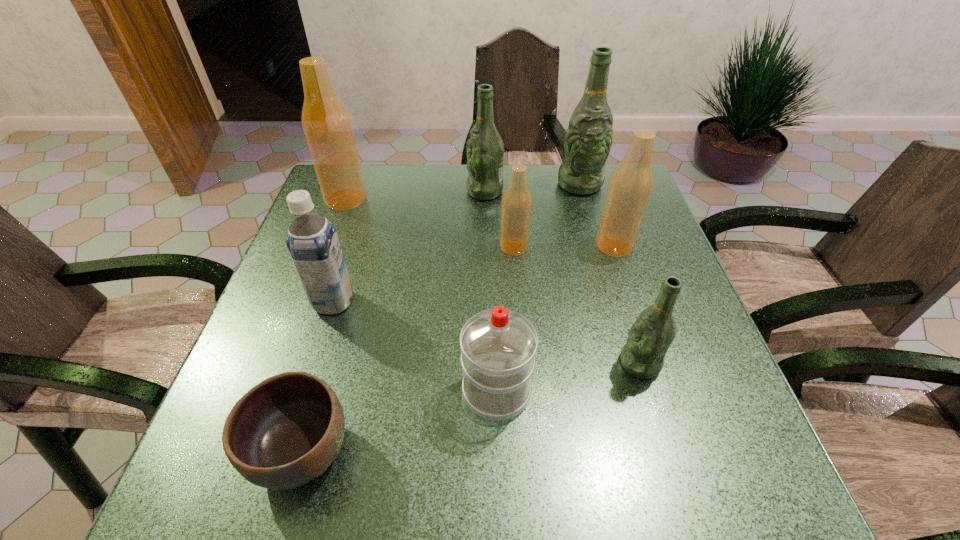
I want to click on the biggest green beer bottle, so click(588, 139).

Where is `the biggest tan beer bottle`? The image size is (960, 540). the biggest tan beer bottle is located at coordinates (326, 123).

Where is `the leftmost beer bottle`? This screenshot has height=540, width=960. the leftmost beer bottle is located at coordinates (326, 123).

You are a GUI agent. You are given a task and a screenshot of the screen. Output one action in this format:
    pyautogui.click(x=<x>, y=<y>)
    Task: Click on the leftmost green beer bottle
    
    Given the screenshot: What is the action you would take?
    pyautogui.click(x=485, y=150)

The height and width of the screenshot is (540, 960). I want to click on the rightmost tan beer bottle, so click(631, 183).

The height and width of the screenshot is (540, 960). Find the location of `soya milk`. soya milk is located at coordinates (312, 241).

The height and width of the screenshot is (540, 960). Find the location of `the smallest tan beer bottle`. the smallest tan beer bottle is located at coordinates (x=516, y=204).

The height and width of the screenshot is (540, 960). In order to click on the smallest green beer bottle in this screenshot , I will do `click(651, 335)`.

Image resolution: width=960 pixels, height=540 pixels. I want to click on the nearest beer bottle, so click(651, 335).

What are the coordinates of `white water bottle` in the screenshot? It's located at (498, 346).